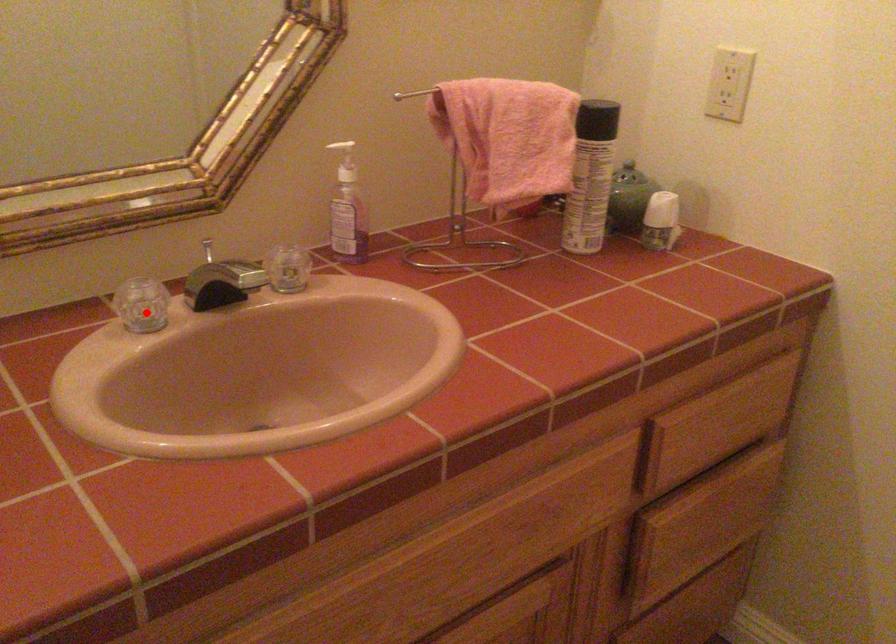
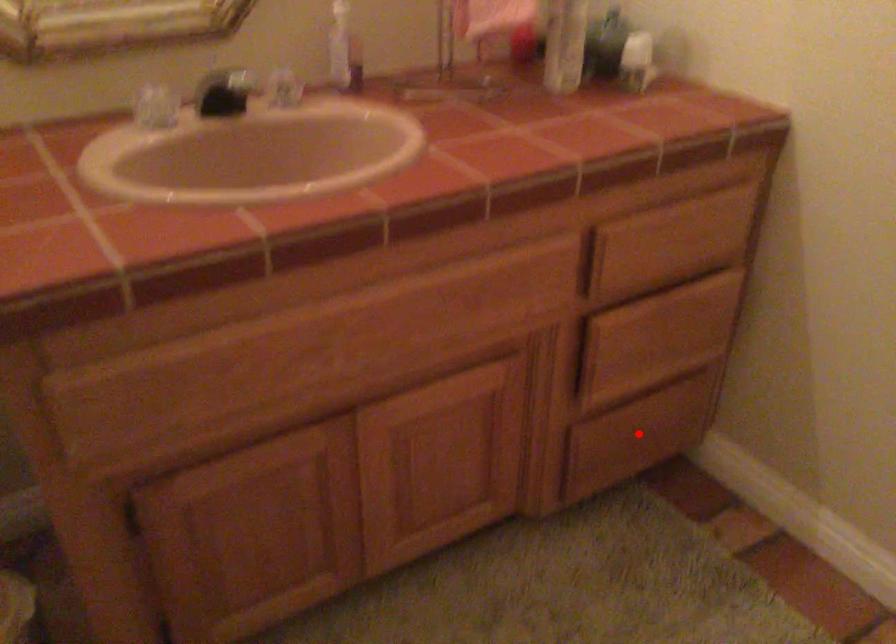
I am providing you with two images of the same scene from different viewpoints. A red point is marked on the first image and another point is marked on the second image. Are the points marked in image1 and image2 representing the same 3D position?

No